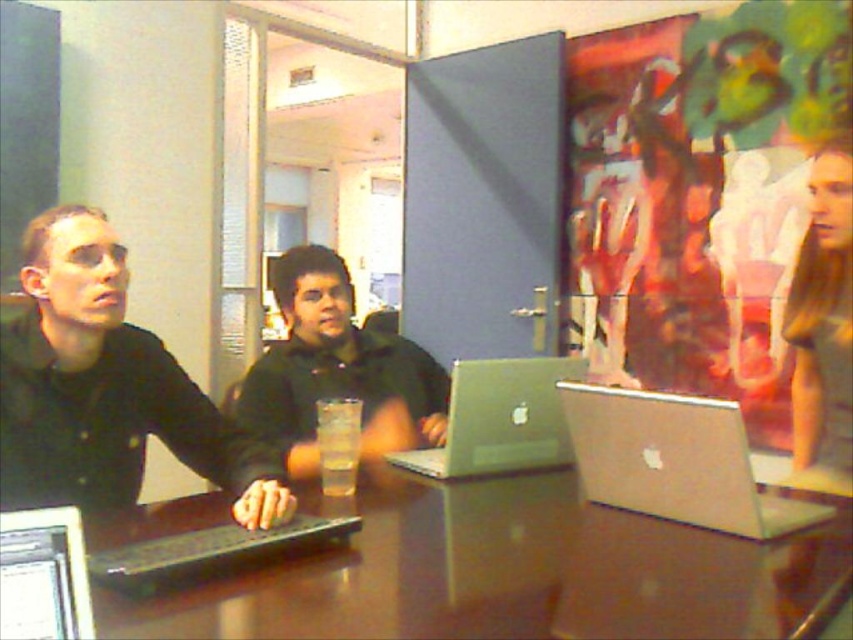
Question: Does silver metallic laptop at right appear on the right side of black matte laptop at left?

Choices:
 (A) no
 (B) yes

Answer: (B)

Question: In this image, where is white glossy monitor at lower left located relative to clear plastic cup at center?

Choices:
 (A) below
 (B) above

Answer: (A)

Question: Which object is positioned closest to the blonde hair at upper right?

Choices:
 (A) black matte laptop at left
 (B) silver metallic laptop at center

Answer: (B)

Question: Which object appears farthest from the camera in this image?

Choices:
 (A) clear plastic cup at center
 (B) brown glossy table at center
 (C) silver metallic laptop at right

Answer: (A)

Question: Which object appears farthest from the camera in this image?

Choices:
 (A) black matte laptop at left
 (B) white glossy monitor at lower left
 (C) clear plastic cup at center

Answer: (C)

Question: Does matte black shirt at left have a greater width compared to black matte laptop at left?

Choices:
 (A) yes
 (B) no

Answer: (A)